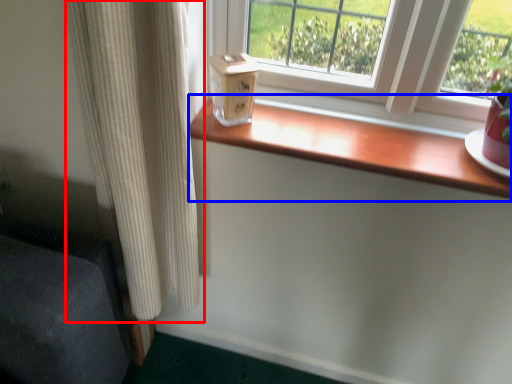
Question: Which of the following is the closest to the observer, curtain (highlighted by a red box) or window sill (highlighted by a blue box)?

Choices:
 (A) curtain
 (B) window sill

Answer: (A)